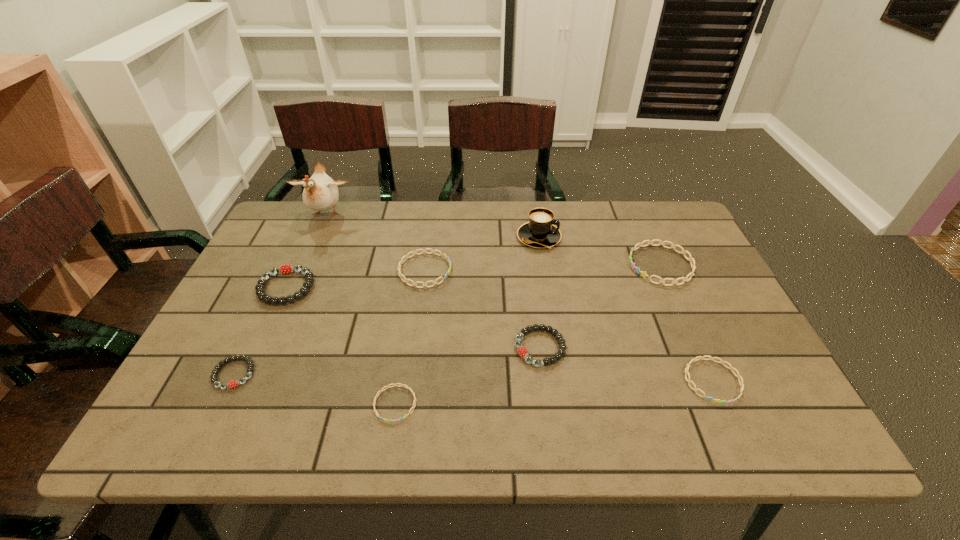
This screenshot has width=960, height=540. I want to click on free space located 0.390m on the right of the second biggest black bracelet, so click(x=732, y=348).

Identify the location of free space located 0.050m on the surface of the third biggest blue bracelet showing star-shaped elements. (733, 427).

This screenshot has height=540, width=960. Identify the location of vacant point located 0.330m on the right of the smallest black bracelet. (403, 374).

You are a GUI agent. You are given a task and a screenshot of the screen. Output one action in this format:
    pyautogui.click(x=<x>, y=<y>)
    Task: Click on the bird located at the far edge
    This screenshot has height=540, width=960.
    Given the screenshot: What is the action you would take?
    pyautogui.click(x=320, y=193)

Locate an element on the screen. This screenshot has width=960, height=540. cappuccino at the far edge is located at coordinates (540, 232).

Find the location of `bracelet positioned at the far edge`. bracelet positioned at the far edge is located at coordinates (643, 274).

The image size is (960, 540). Find the location of `bird that is at the left edge`. bird that is at the left edge is located at coordinates (320, 193).

Find the location of a particular element. Image resolution: width=960 pixels, height=540 pixels. object present at the far left corner is located at coordinates (320, 193).

At what (x,y) coordinates should I click in order to perform the action: click on object at the far right corner. Please return your answer as a coordinate pair (x, y). Looking at the image, I should click on pyautogui.click(x=643, y=274).

This screenshot has width=960, height=540. Identify the location of object situated at the near right corner. (731, 368).